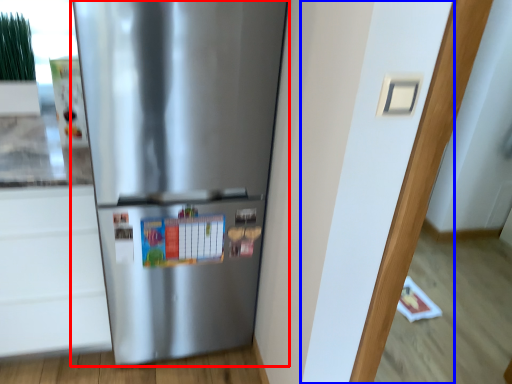
Question: Which object is closer to the camera taking this photo, refrigerator (highlighted by a red box) or door (highlighted by a blue box)?

Choices:
 (A) refrigerator
 (B) door

Answer: (B)